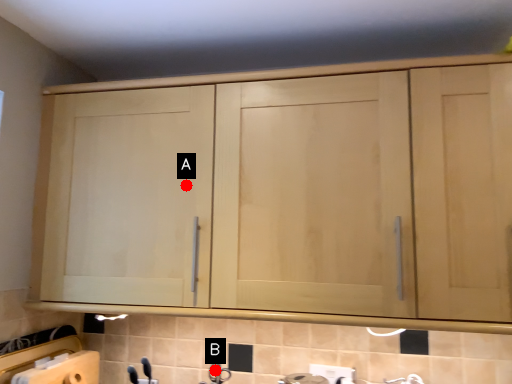
Question: Two points are circled on the image, labeled by A and B beside each circle. Which point is closer to the camera?

Choices:
 (A) A is closer
 (B) B is closer

Answer: (A)